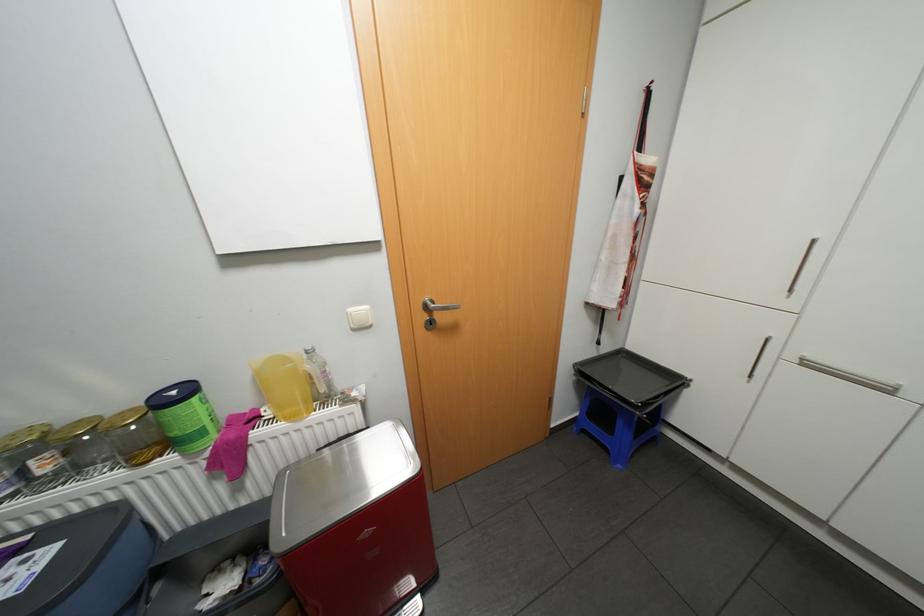
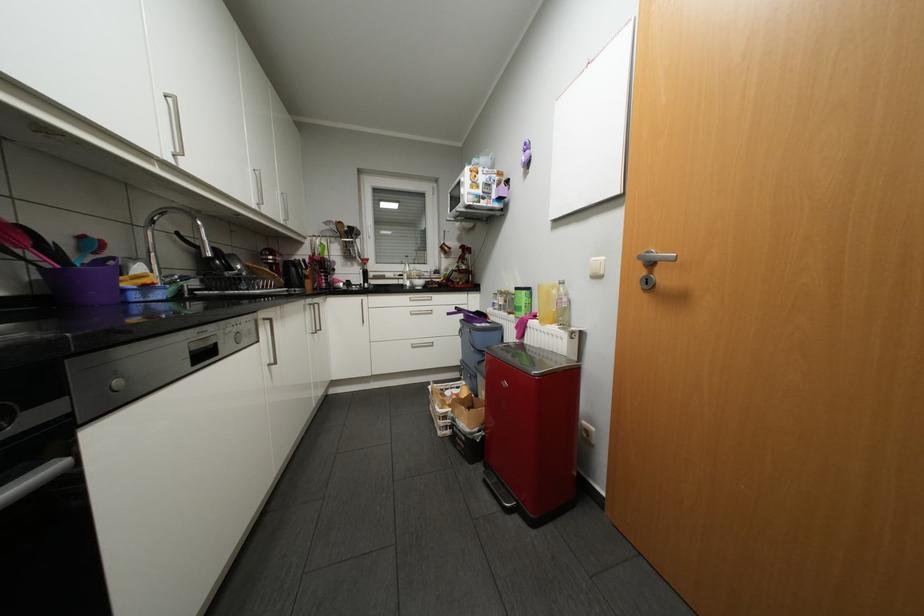
Question: The camera is either moving clockwise (left) or counter-clockwise (right) around the object. The first image is from the beginning of the video and the second image is from the end. Is the camera moving left or right when shooting the video?

Choices:
 (A) Left
 (B) Right

Answer: (B)